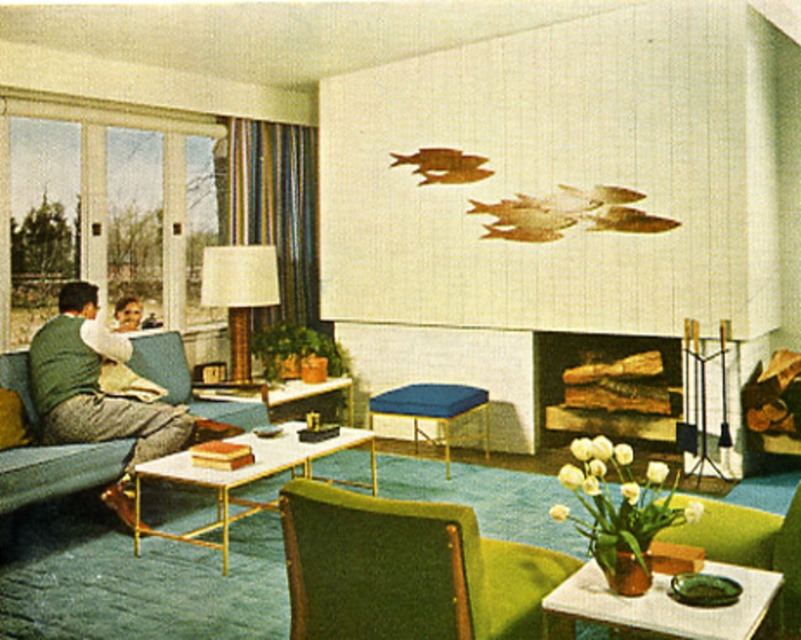
Question: Which object is the closest to the white marble coffee table at center?

Choices:
 (A) blue fabric ottoman at center
 (B) green fabric couch at left

Answer: (B)

Question: Which object is the farthest from the blue fabric ottoman at center?

Choices:
 (A) green fabric side table at lower right
 (B) wooden logs at center
 (C) white marble coffee table at center

Answer: (A)

Question: Considering the relative positions of green fabric side table at lower right and white marble coffee table at center in the image provided, where is green fabric side table at lower right located with respect to white marble coffee table at center?

Choices:
 (A) right
 (B) left

Answer: (A)

Question: Which is farther from the white marble coffee table at center?

Choices:
 (A) wooden logs at center
 (B) blue fabric ottoman at center

Answer: (A)

Question: Is white marble coffee table at center further to camera compared to matte brown lampshade at center?

Choices:
 (A) no
 (B) yes

Answer: (A)

Question: Observing the image, what is the correct spatial positioning of green fabric armchair at lower center in reference to green fabric side table at lower right?

Choices:
 (A) above
 (B) below

Answer: (A)